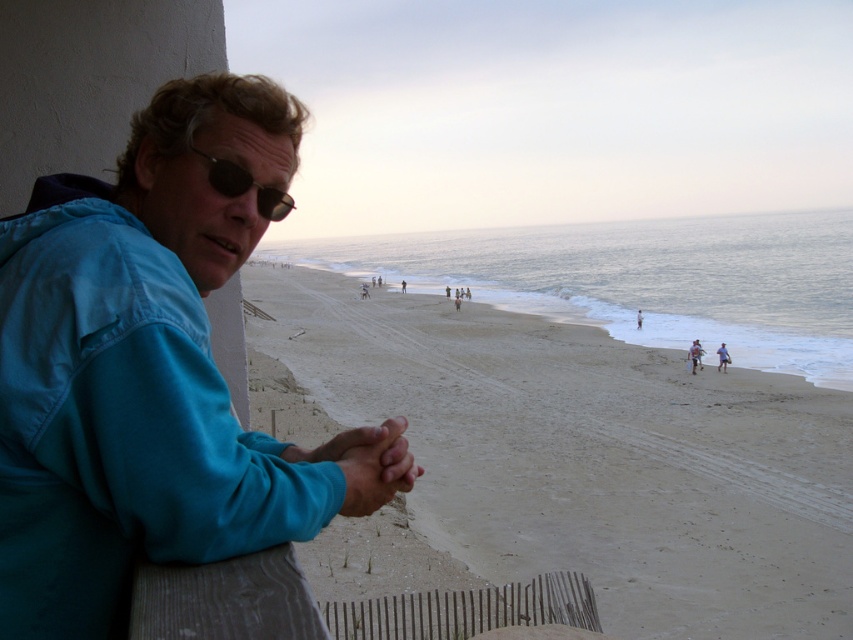
Does blue fabric jacket at left appear over black reflective sunglasses at upper left?

Actually, blue fabric jacket at left is below black reflective sunglasses at upper left.

Is blue fabric jacket at left shorter than black reflective sunglasses at upper left?

In fact, blue fabric jacket at left may be taller than black reflective sunglasses at upper left.

Does point (32, 616) lie behind point (227, 195)?

No, it is not.

This screenshot has height=640, width=853. In order to click on blue fabric jacket at left in this screenshot , I will do `click(149, 372)`.

Can you confirm if smooth sand beach at center is wider than black reflective sunglasses at upper left?

Yes, smooth sand beach at center is wider than black reflective sunglasses at upper left.

Who is lower down, smooth sand beach at center or black reflective sunglasses at upper left?

smooth sand beach at center

At what (x,y) coordinates should I click in order to perform the action: click on smooth sand beach at center. Please return your answer as a coordinate pair (x, y). The image size is (853, 640). Looking at the image, I should click on (590, 456).

Is smooth sand beach at center shorter than blue fabric jacket at left?

No.

Between smooth sand beach at center and blue fabric jacket at left, which one appears on the left side from the viewer's perspective?

blue fabric jacket at left is more to the left.

Which is behind, point (438, 385) or point (56, 396)?

The point (438, 385) is more distant.

The width and height of the screenshot is (853, 640). Find the location of `smooth sand beach at center`. smooth sand beach at center is located at coordinates (590, 456).